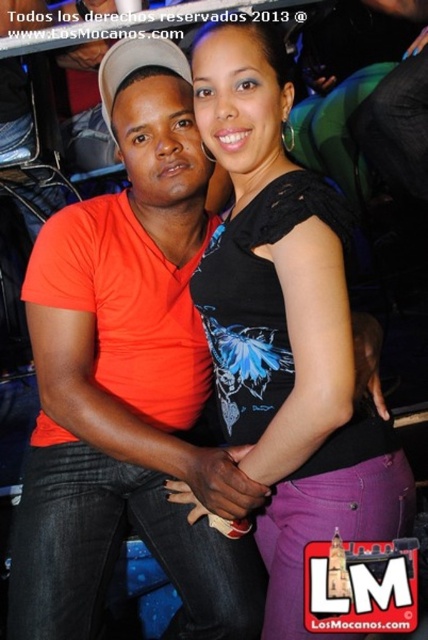
Is orange cotton t-shirt at center to the right of black lace top at center from the viewer's perspective?

Incorrect, orange cotton t-shirt at center is not on the right side of black lace top at center.

Which is in front, point (101, 476) or point (237, 221)?

Point (237, 221) is more forward.

You are a GUI agent. You are given a task and a screenshot of the screen. Output one action in this format:
    pyautogui.click(x=<x>, y=<y>)
    Task: Click on the orange cotton t-shirt at center
    This screenshot has width=428, height=640.
    Given the screenshot: What is the action you would take?
    pyautogui.click(x=128, y=381)